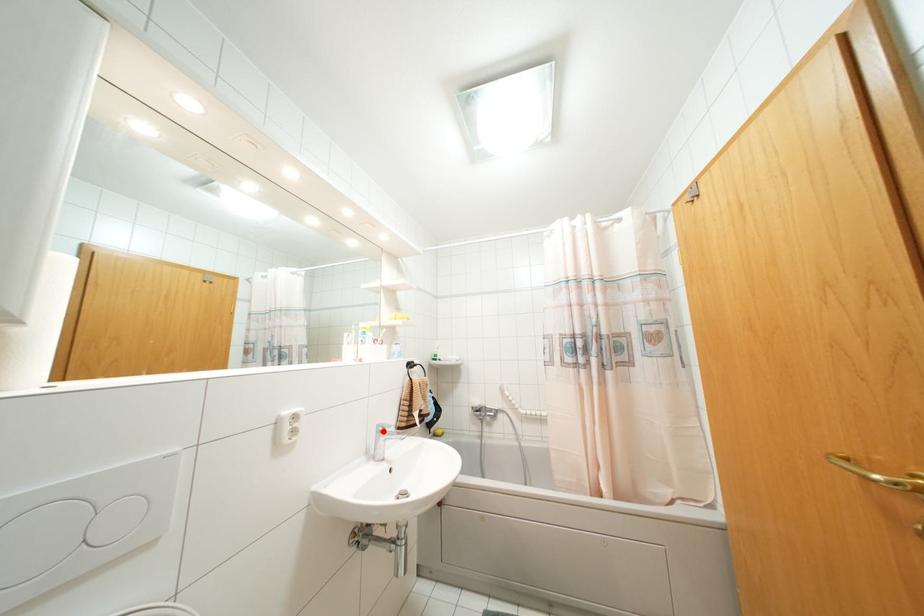
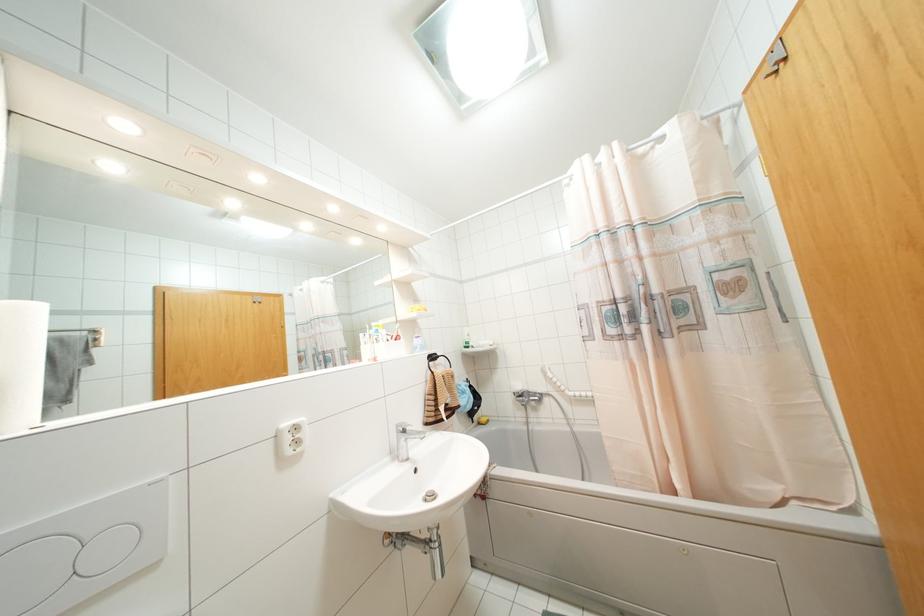
The point at the highlighted location is marked in the first image. Where is the corresponding point in the second image?

(404, 431)